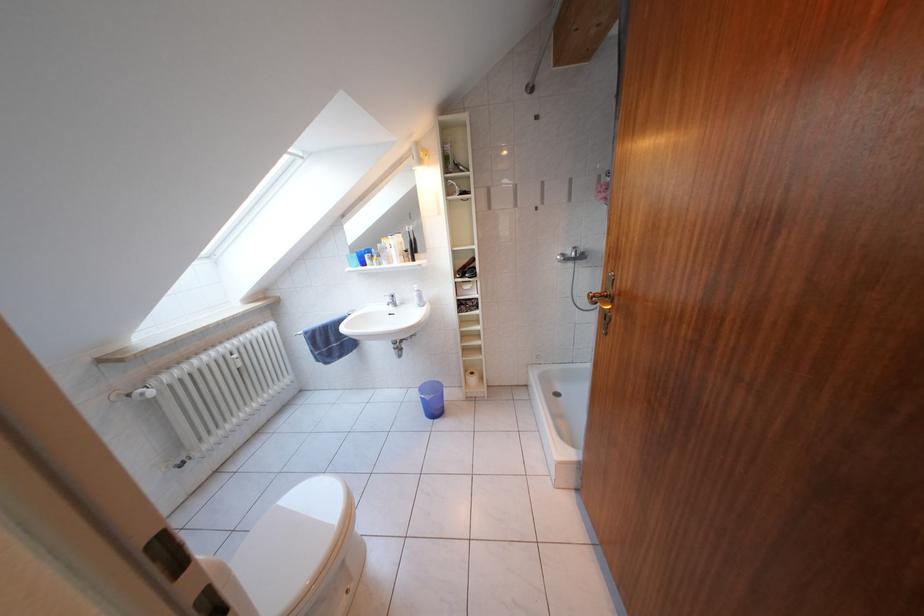
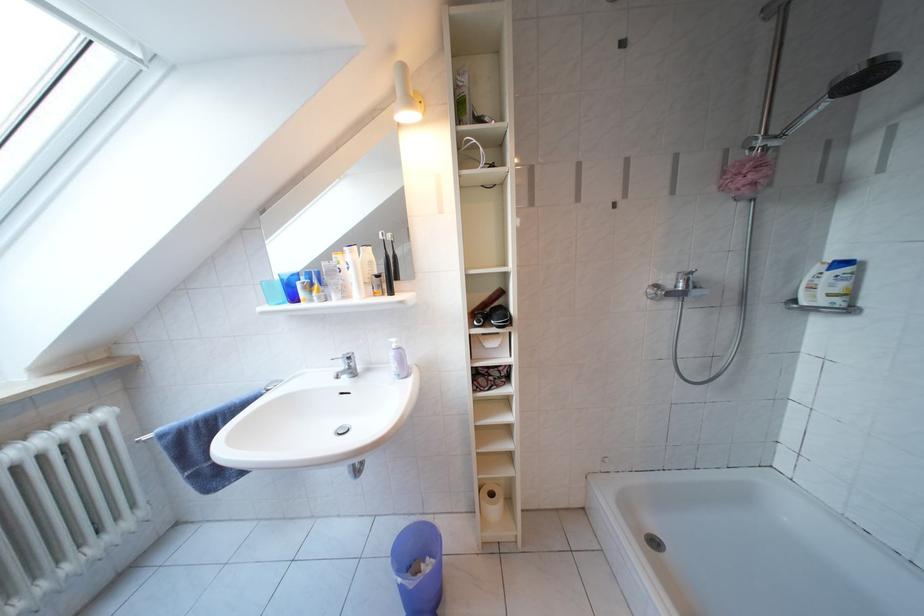
In the second image, find the point that corresponds to the point at 415,256 in the first image.

(386, 281)